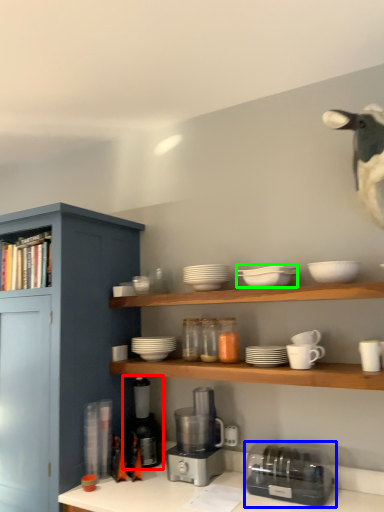
Question: Which is nearer to the coffee machine (highlighted by a red box)? toaster (highlighted by a blue box) or tableware (highlighted by a green box).

Choices:
 (A) toaster
 (B) tableware

Answer: (A)